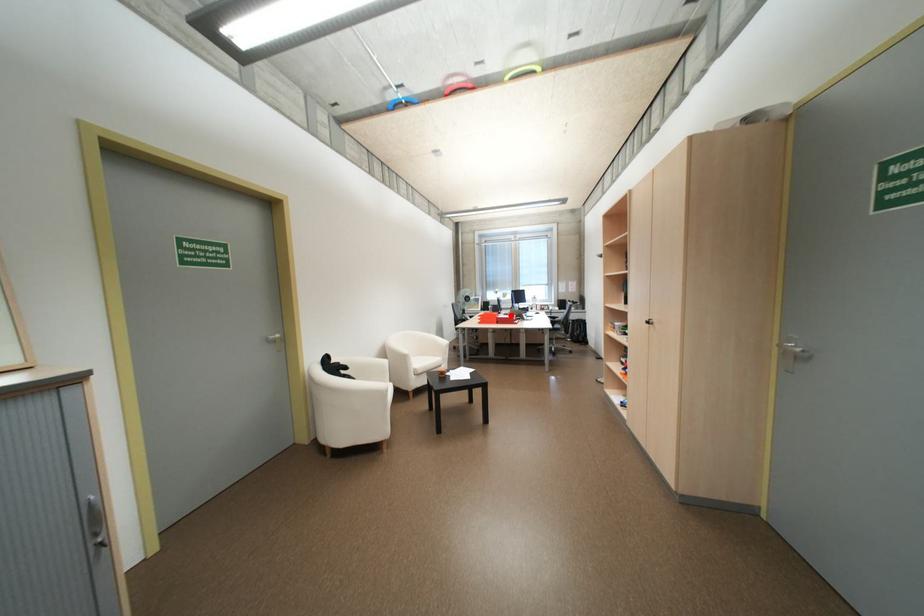
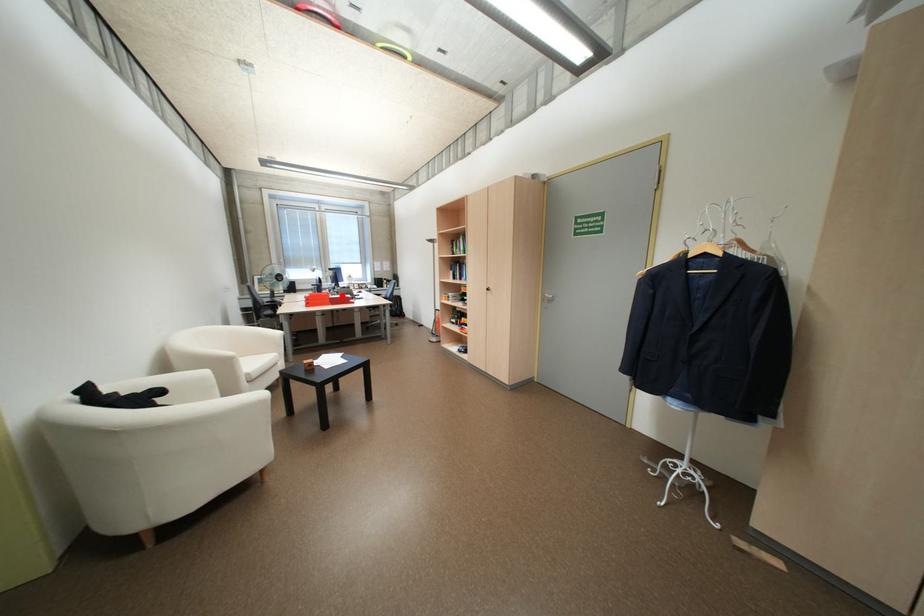
I am providing you with two images of the same scene from different viewpoints. A red point is marked on the first image and another point is marked on the second image. Are the points marked in image1 and image2 representing the same 3D position?

Yes